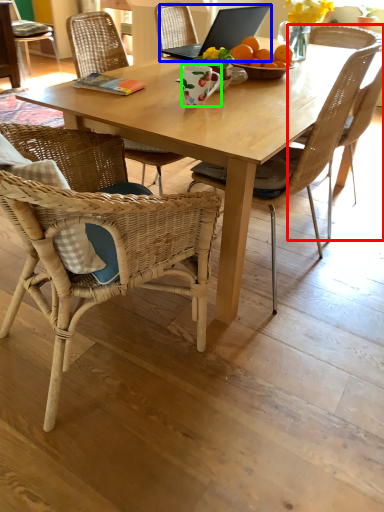
Question: Which object is the closest to the chair (highlighted by a red box)? Choose among these: laptop (highlighted by a blue box) or coffee cup (highlighted by a green box).

Choices:
 (A) laptop
 (B) coffee cup

Answer: (A)